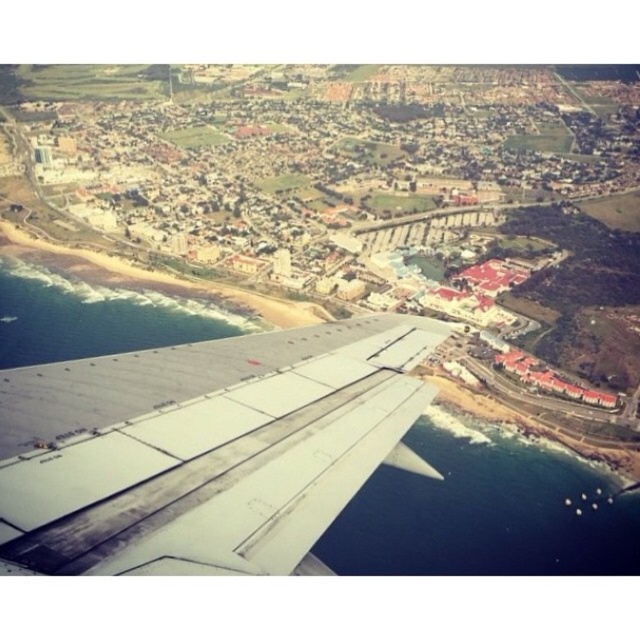
Question: Among these points, which one is farthest from the camera?

Choices:
 (A) (592, 561)
 (B) (148, 547)

Answer: (A)

Question: Does gray metallic wing at lower left come behind deep blue water at lower right?

Choices:
 (A) yes
 (B) no

Answer: (B)

Question: Which of the following is the farthest from the observer?

Choices:
 (A) (417, 497)
 (B) (189, 524)

Answer: (A)

Question: Can you confirm if gray metallic wing at lower left is thinner than deep blue water at lower right?

Choices:
 (A) yes
 (B) no

Answer: (A)

Question: Does gray metallic wing at lower left have a smaller size compared to deep blue water at lower right?

Choices:
 (A) no
 (B) yes

Answer: (B)